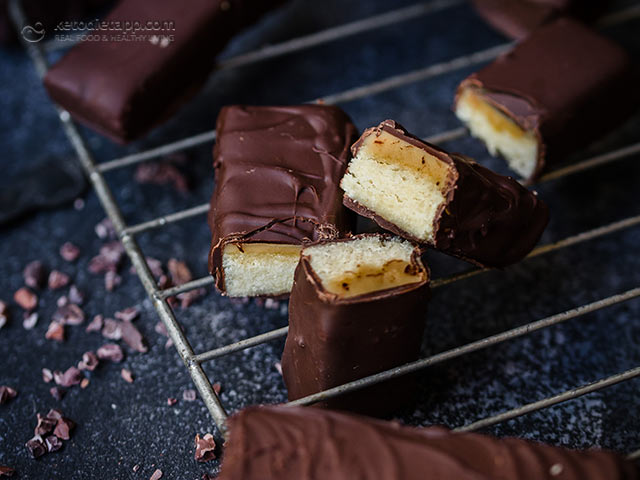
Find the location of `1 metal rack`. 1 metal rack is located at coordinates (202, 356).